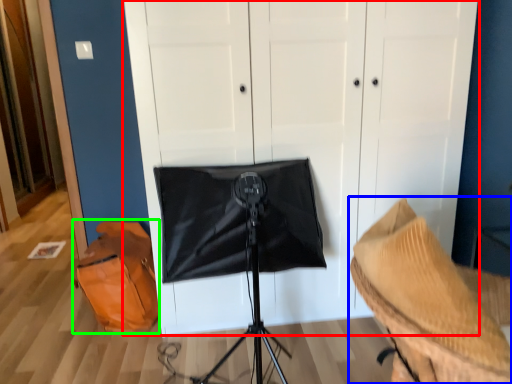
Question: Which object is positioned closest to dresser (highlighted by a red box)? Select from furniture (highlighted by a blue box) and messenger bag (highlighted by a green box).

Choices:
 (A) furniture
 (B) messenger bag

Answer: (B)